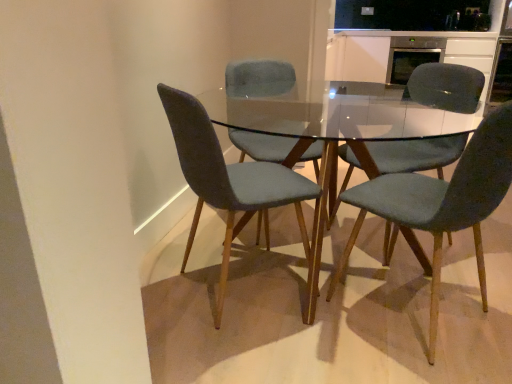
Question: In which direction should I rotate to look at velvet teal chair at center, positioned as the fourth chair in left-to-right order?

Choices:
 (A) right
 (B) left

Answer: (A)

Question: From the image's perspective, is satin white cabinet at upper right below velvet grey chair at center, positioned as the 4th chair in right-to-left order?

Choices:
 (A) no
 (B) yes

Answer: (A)

Question: Is satin white cabinet at upper right in contact with velvet grey chair at center, positioned as the 4th chair in right-to-left order?

Choices:
 (A) yes
 (B) no

Answer: (B)

Question: Is velvet grey chair at center, positioned as the 4th chair in right-to-left order, a part of satin white cabinet at upper right?

Choices:
 (A) yes
 (B) no

Answer: (B)

Question: Considering the relative sizes of satin white cabinet at upper right and velvet grey chair at center, the 1th chair in the left-to-right sequence, in the image provided, is satin white cabinet at upper right shorter than velvet grey chair at center, the 1th chair in the left-to-right sequence,?

Choices:
 (A) yes
 (B) no

Answer: (B)

Question: Can we say satin white cabinet at upper right lies outside velvet grey chair at center, the 1th chair in the left-to-right sequence?

Choices:
 (A) yes
 (B) no

Answer: (A)

Question: Does satin white cabinet at upper right have a lesser width compared to velvet grey chair at center, positioned as the 4th chair in right-to-left order?

Choices:
 (A) no
 (B) yes

Answer: (A)

Question: Does velvet grey chair at center, positioned as the 4th chair in right-to-left order, have a lesser height compared to satin white cabinet at upper right?

Choices:
 (A) yes
 (B) no

Answer: (A)

Question: From the image's perspective, would you say velvet grey chair at center, the 1th chair in the left-to-right sequence, is shown under satin white cabinet at upper right?

Choices:
 (A) no
 (B) yes

Answer: (B)

Question: Can you confirm if velvet grey chair at center, positioned as the 4th chair in right-to-left order, is bigger than satin white cabinet at upper right?

Choices:
 (A) yes
 (B) no

Answer: (B)

Question: Considering the relative sizes of velvet grey chair at center, positioned as the 4th chair in right-to-left order, and satin white cabinet at upper right in the image provided, is velvet grey chair at center, positioned as the 4th chair in right-to-left order, taller than satin white cabinet at upper right?

Choices:
 (A) no
 (B) yes

Answer: (A)

Question: Does velvet grey chair at center, the 1th chair in the left-to-right sequence, have a smaller size compared to satin white cabinet at upper right?

Choices:
 (A) yes
 (B) no

Answer: (A)

Question: Considering the relative positions of velvet grey chair at center, positioned as the 4th chair in right-to-left order, and satin white cabinet at upper right in the image provided, is velvet grey chair at center, positioned as the 4th chair in right-to-left order, in front of satin white cabinet at upper right?

Choices:
 (A) no
 (B) yes

Answer: (B)

Question: Is stainless steel oven at upper right positioned beyond the bounds of velvet grey chair at center, positioned as the 4th chair in right-to-left order?

Choices:
 (A) no
 (B) yes

Answer: (B)